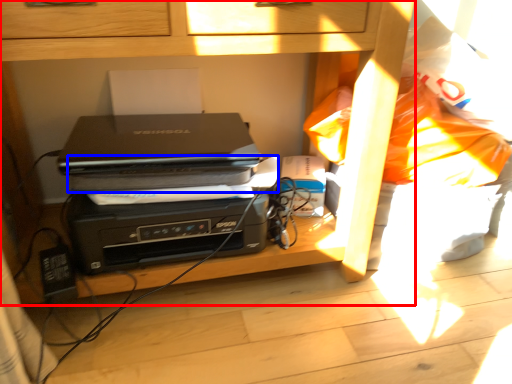
Question: Which object is further to the camera taking this photo, furniture (highlighted by a red box) or paperback book (highlighted by a blue box)?

Choices:
 (A) furniture
 (B) paperback book

Answer: (B)